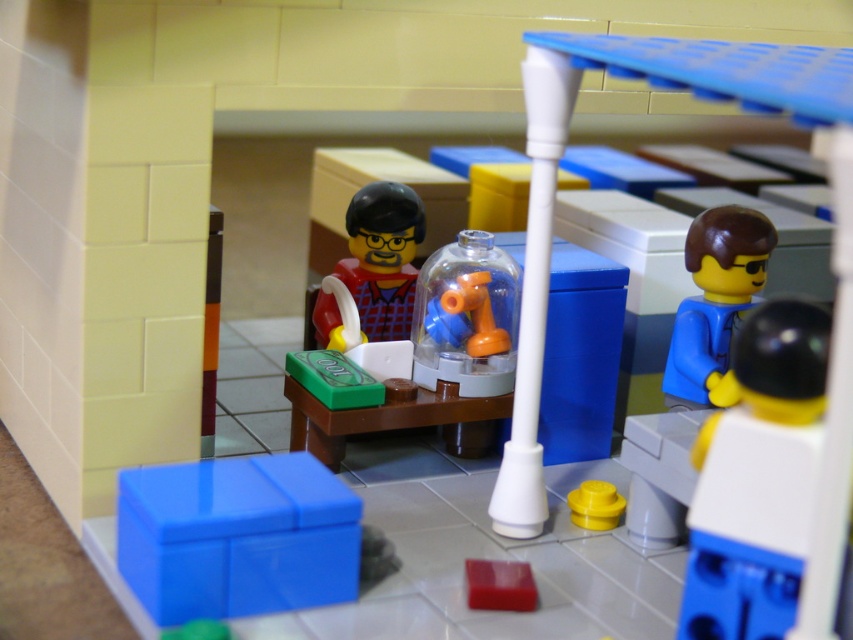
Question: Which point is farther from the camera taking this photo?

Choices:
 (A) pyautogui.click(x=675, y=356)
 (B) pyautogui.click(x=767, y=557)

Answer: (A)

Question: Is white plastic figure at right smaller than matte red shirt at center?

Choices:
 (A) yes
 (B) no

Answer: (B)

Question: Which point appears closest to the camera in this image?

Choices:
 (A) (793, 484)
 (B) (405, 333)
 (C) (704, 369)
 (D) (494, 589)

Answer: (A)

Question: Can you confirm if smooth red brick at lower center is thinner than orange matte faucet at center?

Choices:
 (A) no
 (B) yes

Answer: (B)

Question: Which of the following is the farthest from the observer?

Choices:
 (A) (529, 605)
 (B) (807, 308)
 (C) (497, 336)
 (D) (732, 248)

Answer: (C)

Question: Does blue matte figure at right appear under matte red shirt at center?

Choices:
 (A) yes
 (B) no

Answer: (A)